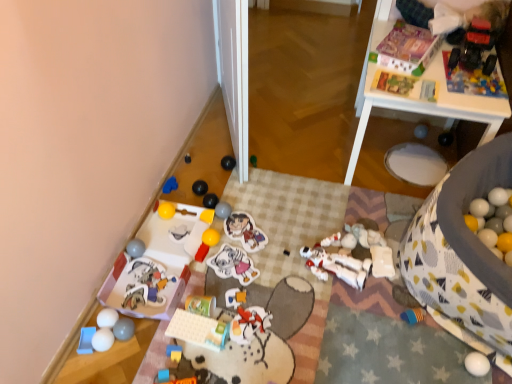
Locate an element on the screen. Image resolution: width=512 pixels, height=384 pixels. vacant area that lies between matte plastic toy at lower left, the 5th toy in the left-to-right sequence, and smooth plastic balls at lower left, the 23th toy when ordered from right to left is located at coordinates (136, 322).